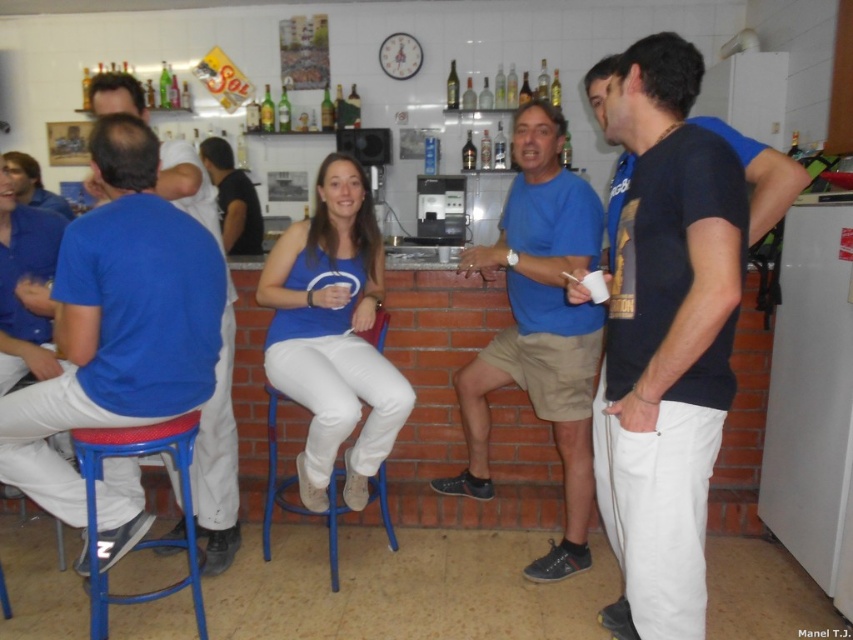
You are a customer at the bar and want to sit on the blue metal bar stool at center. The matte blue tank top at center is currently blocking your path. Can you move around it to reach the stool?

The matte blue tank top at center is above the blue metal bar stool at center, meaning it is likely worn by someone sitting on the stool. Therefore, you cannot move around it to reach the stool because the person wearing the matte blue tank top at center is already occupying the blue metal bar stool at center.

Based on the photo, you are a new customer entering the bar and want to join the group. The bar has a 2 meter wide entrance. Can you walk between the blue cotton shirt at center and the black cotton shirt at center through the entrance?

The distance between the blue cotton shirt at center and the black cotton shirt at center is 1.96 meters, which is slightly less than the 2 meter entrance width. Therefore, you can walk through the entrance between them but may need to move carefully to avoid contact.

You are a customer entering the bar and want to sit on the blue plastic stool at lower left. Is the blue cotton shirt at left blocking your path to the stool?

The blue plastic stool at lower left is behind the blue cotton shirt at left, so the blue cotton shirt at left is blocking the path to the stool.